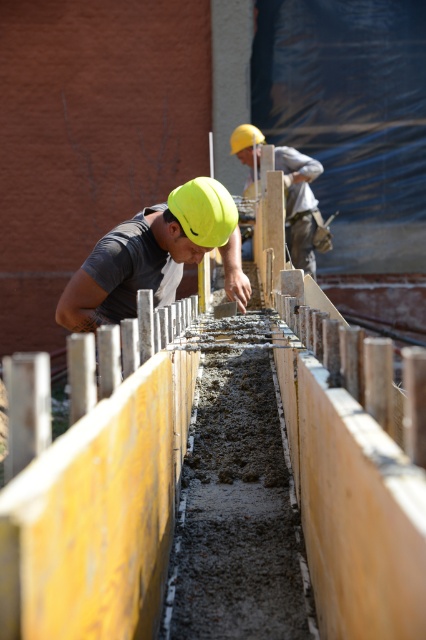
Which is below, neon yellow hard hat at center or yellow hard hat at center?

neon yellow hard hat at center is lower down.

Between neon yellow hard hat at center and yellow hard hat at center, which one has more height?

yellow hard hat at center is taller.

Is point (227, 212) less distant than point (302, 157)?

Yes.

The height and width of the screenshot is (640, 426). What are the coordinates of `neon yellow hard hat at center` in the screenshot? It's located at (154, 257).